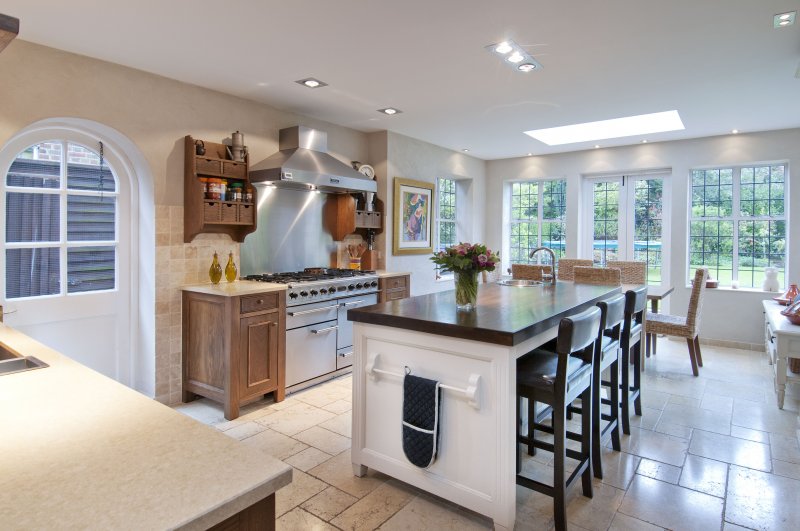
Locate an element on the screen. The width and height of the screenshot is (800, 531). door is located at coordinates (93, 196).